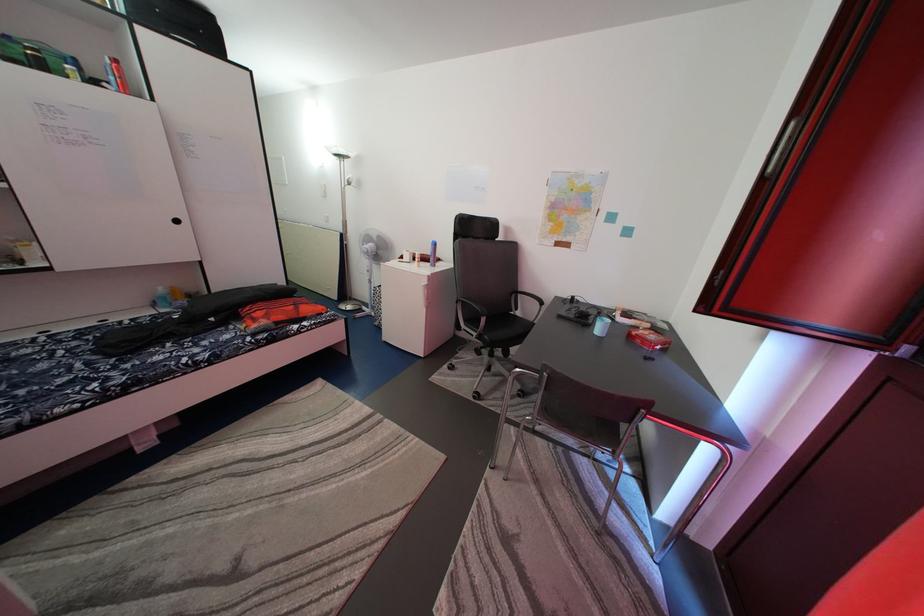
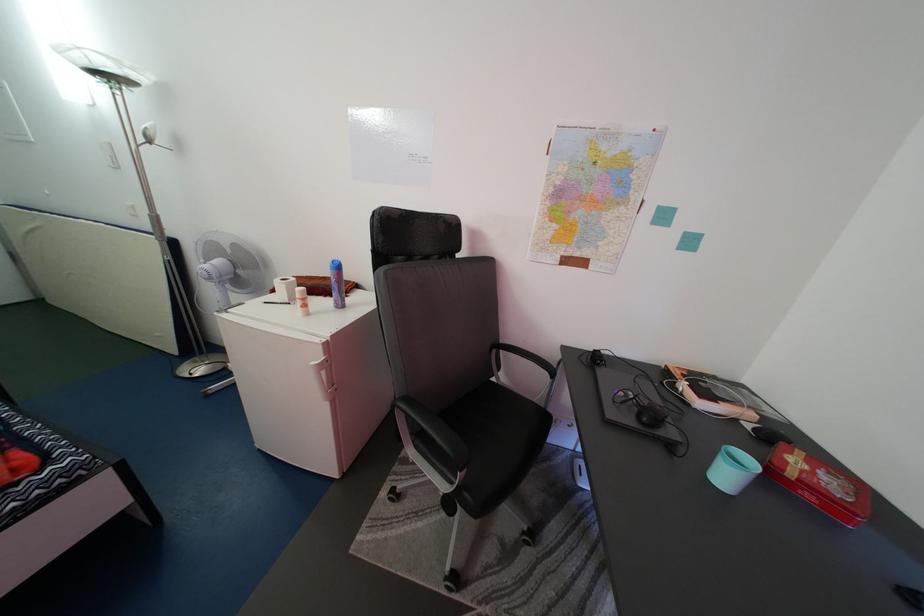
In the second image, find the point that corresponds to point (626, 321) in the first image.

(691, 392)